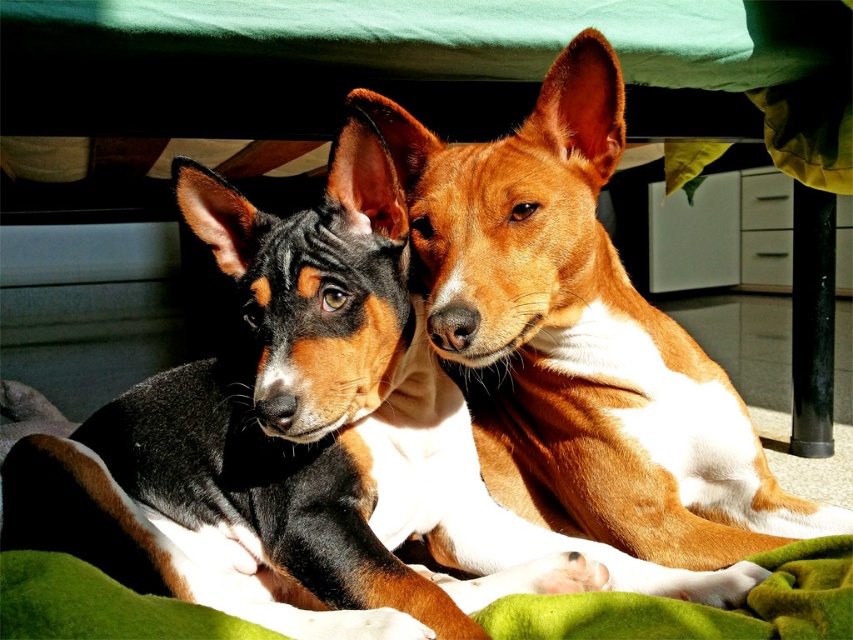
Who is higher up, black and tan fur dog at center or brown/white fur dog at center?

brown/white fur dog at center is higher up.

The height and width of the screenshot is (640, 853). I want to click on black and tan fur dog at center, so click(x=285, y=435).